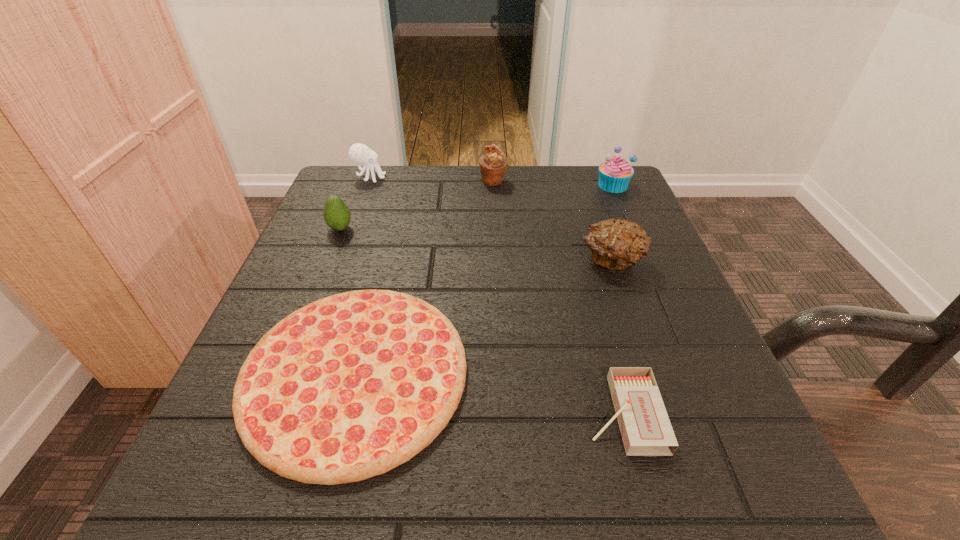
This screenshot has height=540, width=960. Identify the location of object that ranks as the fifth closest to the shortest object. (359, 153).

Identify which object is the nearest to the matchbox. Please provide its 2D coordinates. Your answer should be formatted as a tuple, i.e. [(x, y)], where the tuple contains the x and y coordinates of a point satisfying the conditions above.

[(348, 387)]

Choose which muffin is the third nearest neighbor to the second shortest object. Please provide its 2D coordinates. Your answer should be formatted as a tuple, i.e. [(x, y)], where the tuple contains the x and y coordinates of a point satisfying the conditions above.

[(493, 164)]

You are a GUI agent. You are given a task and a screenshot of the screen. Output one action in this format:
    pyautogui.click(x=<x>, y=<y>)
    Task: Click on the closest muffin relative to the leftmost muffin
    This screenshot has width=960, height=540.
    Given the screenshot: What is the action you would take?
    pyautogui.click(x=614, y=175)

This screenshot has width=960, height=540. What are the coordinates of `free spot that satisfies the following two spatial constraints: 1. on the front-facing side of the fourth object from left to right; 2. on the right side of the octopus` in the screenshot? It's located at (369, 181).